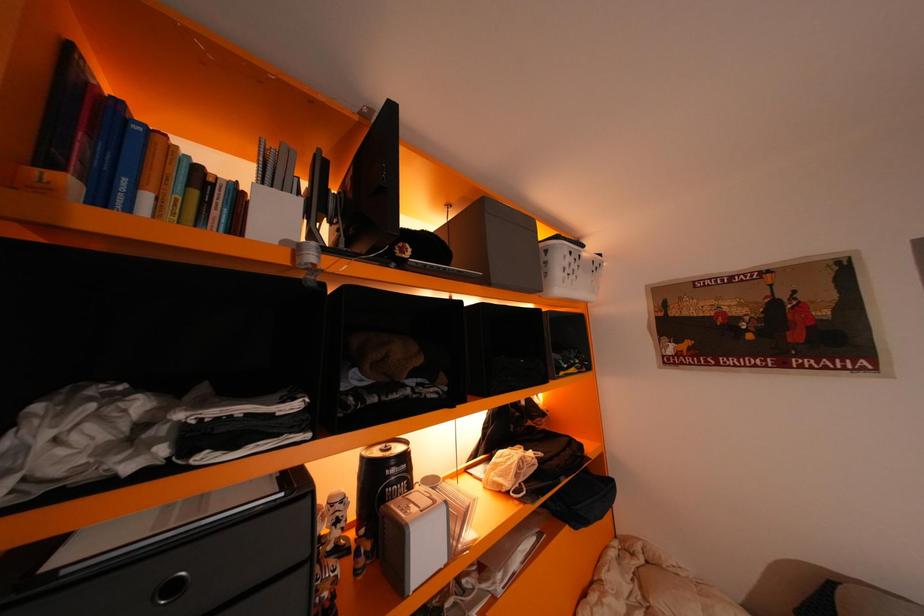
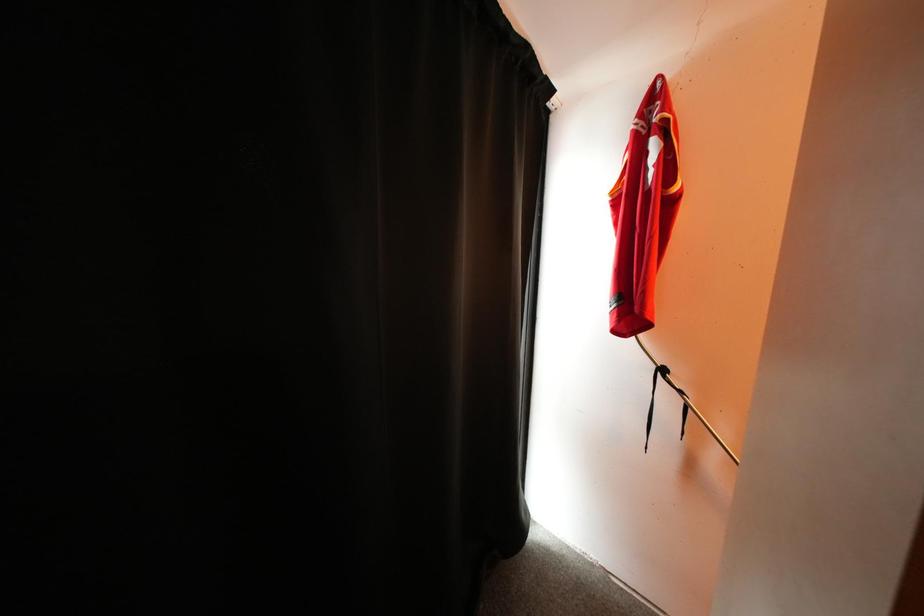
Question: The camera is either moving clockwise (left) or counter-clockwise (right) around the object. The first image is from the beginning of the video and the second image is from the end. Is the camera moving left or right when shooting the video?

Choices:
 (A) Left
 (B) Right

Answer: (B)